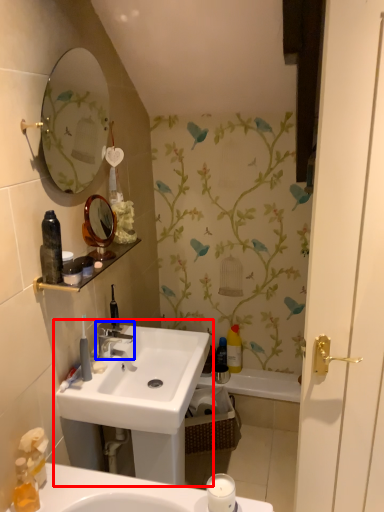
Question: Which object is closer to the camera taking this photo, sink (highlighted by a red box) or tap (highlighted by a blue box)?

Choices:
 (A) sink
 (B) tap

Answer: (A)